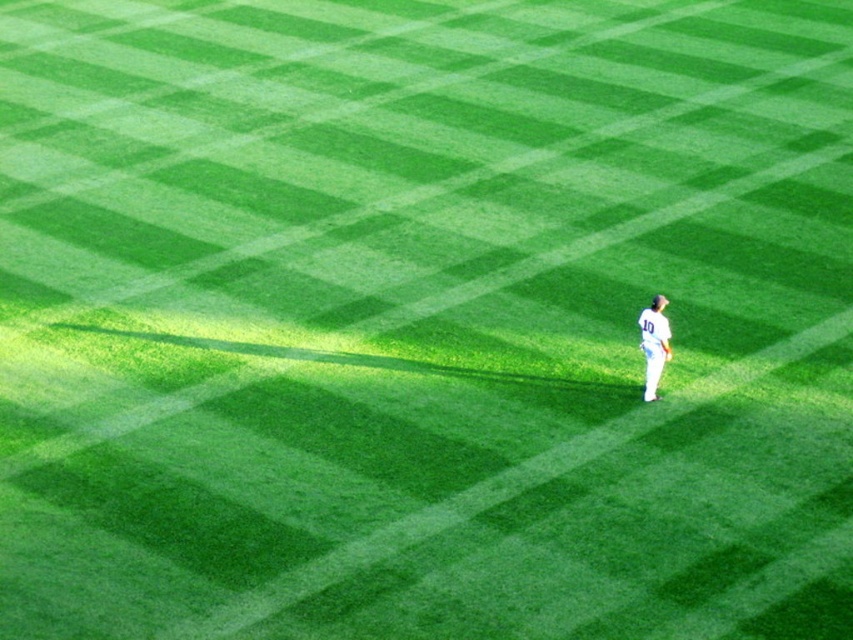
You are a drone operator tasked with capturing aerial footage of the baseball field. The drone is currently hovering at the center of the field, which is at point coordinates of approximately 0.5,0.5. The white jersey at right is located at 0.537,0.767. To ensure the player is visible in the footage, in which cardinal direction should you tilt the camera? Please choose from North, South, East, or West.

The white jersey at right is located at coordinates (653,342). Since the center of the field is at (426,320), the player is slightly to the East and North of the center. Therefore, tilting the camera towards the Northeast direction would ensure visibility.